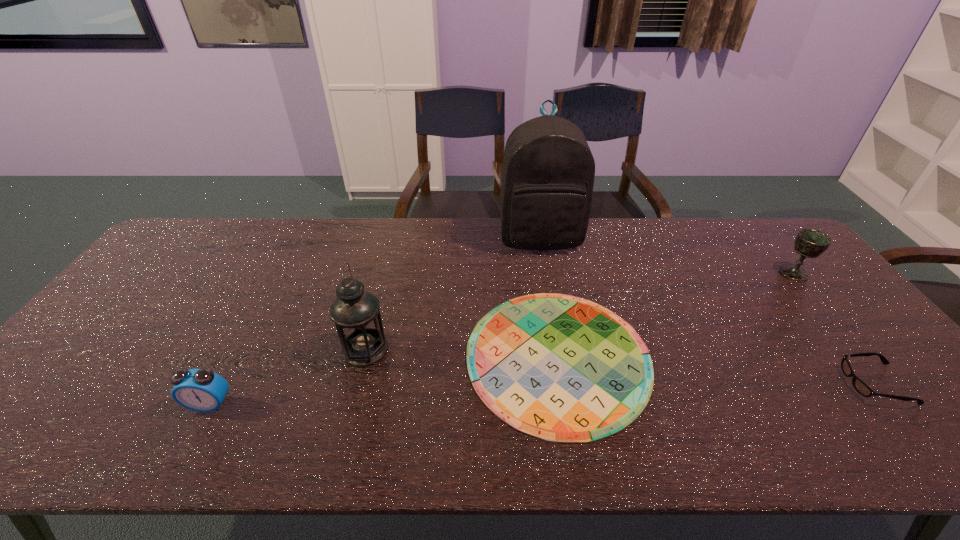
Locate an element on the screen. blank region between the oil lamp and the gameboard is located at coordinates (462, 353).

Image resolution: width=960 pixels, height=540 pixels. Find the location of `free spot between the leftmost object and the fifth object from right to left`. free spot between the leftmost object and the fifth object from right to left is located at coordinates (287, 376).

Where is `empty space that is in between the gameboard and the chalice`? empty space that is in between the gameboard and the chalice is located at coordinates (676, 315).

The image size is (960, 540). In order to click on free area in between the spectacles and the gameboard in this screenshot , I will do `click(717, 370)`.

This screenshot has width=960, height=540. In order to click on free spot between the second object from left to right and the tallest object in this screenshot , I will do `click(452, 293)`.

Choose which object is the fifth nearest neighbor to the fourth tallest object. Please provide its 2D coordinates. Your answer should be formatted as a tuple, i.e. [(x, y)], where the tuple contains the x and y coordinates of a point satisfying the conditions above.

[(811, 243)]

Where is `object that is the second nearest to the fifth tallest object`? object that is the second nearest to the fifth tallest object is located at coordinates (561, 368).

In order to click on vacant space that satisfies the following two spatial constraints: 1. on the front side of the second farthest object; 2. on the front-facing side of the second shortest object in this screenshot , I will do `click(885, 383)`.

Locate an element on the screen. The image size is (960, 540). vacant space that satisfies the following two spatial constraints: 1. on the front-facing side of the fifth nearest object; 2. on the left side of the tallest object is located at coordinates (545, 273).

Where is `free location that satisfies the following two spatial constraints: 1. on the back side of the chalice; 2. on the left side of the second tallest object`? The image size is (960, 540). free location that satisfies the following two spatial constraints: 1. on the back side of the chalice; 2. on the left side of the second tallest object is located at coordinates (384, 273).